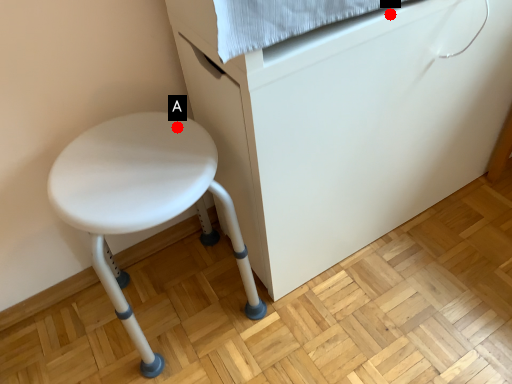
Question: Two points are circled on the image, labeled by A and B beside each circle. Which point is farther to the camera?

Choices:
 (A) A is further
 (B) B is further

Answer: (A)